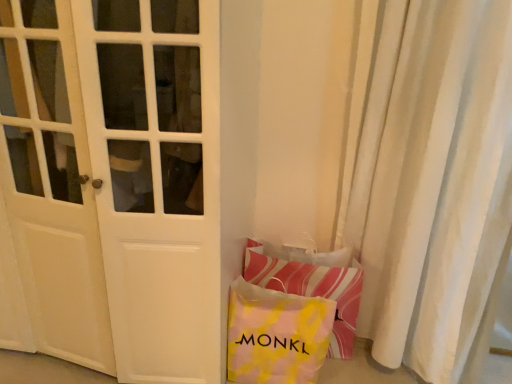
The image size is (512, 384). Describe the element at coordinates (115, 180) in the screenshot. I see `white matte door at center` at that location.

Describe the element at coordinates (276, 335) in the screenshot. I see `yellow tie-dye fabric bag at lower right` at that location.

The width and height of the screenshot is (512, 384). What do you see at coordinates (312, 290) in the screenshot?
I see `striped fabric pillow at lower right` at bounding box center [312, 290].

What are the coordinates of `white textured curtain at right` in the screenshot? It's located at (434, 185).

Can you confirm if white textured curtain at right is shorter than yellow tie-dye fabric bag at lower right?

No, white textured curtain at right is not shorter than yellow tie-dye fabric bag at lower right.

In the scene shown: Is white textured curtain at right completely or partially outside of yellow tie-dye fabric bag at lower right?

Yes, white textured curtain at right is located beyond the bounds of yellow tie-dye fabric bag at lower right.

Considering the relative positions of white textured curtain at right and yellow tie-dye fabric bag at lower right in the image provided, is white textured curtain at right in front of yellow tie-dye fabric bag at lower right?

Yes, white textured curtain at right is closer to the camera.

Relative to white matte door at center, is white textured curtain at right in front or behind?

Visually, white textured curtain at right is located behind white matte door at center.

From their relative heights in the image, would you say white textured curtain at right is taller or shorter than white matte door at center?

In the image, white textured curtain at right appears to be taller than white matte door at center.

Is white textured curtain at right aimed at white matte door at center?

No, white textured curtain at right is not oriented towards white matte door at center.

From the image's perspective, is white textured curtain at right above or below white matte door at center?

From the image's perspective, white textured curtain at right appears below white matte door at center.

From a real-world perspective, which object stands above the other?

white matte door at center.

Which is correct: white matte door at center is inside striped fabric pillow at lower right, or outside of it?

The correct answer is: outside.

Looking at this image, considering the positions of objects white matte door at center and striped fabric pillow at lower right in the image provided, who is more to the left, white matte door at center or striped fabric pillow at lower right?

From the viewer's perspective, white matte door at center appears more on the left side.

What's the angular difference between yellow tie-dye fabric bag at lower right and white matte door at center's facing directions?

1.44 degrees separate the facing orientations of yellow tie-dye fabric bag at lower right and white matte door at center.

Considering the relative sizes of yellow tie-dye fabric bag at lower right and white matte door at center in the image provided, is yellow tie-dye fabric bag at lower right smaller than white matte door at center?

Yes.

Is yellow tie-dye fabric bag at lower right behind white matte door at center?

That is True.

Is point (283, 342) closer or farther from the camera than point (134, 158)?

Point (283, 342).

Is point (383, 346) positioned after point (248, 266)?

No.

From the image's perspective, would you say white textured curtain at right is shown under striped fabric pillow at lower right?

No, from the image's perspective, white textured curtain at right is not beneath striped fabric pillow at lower right.

Is white textured curtain at right surrounding striped fabric pillow at lower right?

Yes, white textured curtain at right contains striped fabric pillow at lower right.

From a real-world perspective, which is physically below, white textured curtain at right or striped fabric pillow at lower right?

From a 3D spatial view, striped fabric pillow at lower right is below.

Based on their positions, is white matte door at center located to the left or right of yellow tie-dye fabric bag at lower right?

white matte door at center is to the left of yellow tie-dye fabric bag at lower right.

Does white matte door at center have a lesser width compared to yellow tie-dye fabric bag at lower right?

No, white matte door at center is not thinner than yellow tie-dye fabric bag at lower right.

What's the angular difference between white matte door at center and yellow tie-dye fabric bag at lower right's facing directions?

They differ by 1.44 degrees in their facing directions.

Are yellow tie-dye fabric bag at lower right and white textured curtain at right beside each other?

No, yellow tie-dye fabric bag at lower right is not with white textured curtain at right.

Can you confirm if yellow tie-dye fabric bag at lower right is positioned to the left of white textured curtain at right?

Correct, you'll find yellow tie-dye fabric bag at lower right to the left of white textured curtain at right.

Find the location of a particular element. pouch below the white textured curtain at right (from the image's perspective) is located at coordinates (276, 335).

Looking at their sizes, would you say yellow tie-dye fabric bag at lower right is wider or thinner than white textured curtain at right?

In the image, yellow tie-dye fabric bag at lower right appears to be more narrow than white textured curtain at right.

Where is `curtain above the yellow tie-dye fabric bag at lower right (from the image's perspective)`? Image resolution: width=512 pixels, height=384 pixels. curtain above the yellow tie-dye fabric bag at lower right (from the image's perspective) is located at coordinates (434, 185).

Where is `curtain behind the white matte door at center`? The height and width of the screenshot is (384, 512). curtain behind the white matte door at center is located at coordinates (434, 185).

Based on their spatial positions, is striped fabric pillow at lower right or white matte door at center further from yellow tie-dye fabric bag at lower right?

white matte door at center is positioned further to the anchor yellow tie-dye fabric bag at lower right.

Estimate the real-world distances between objects in this image. Which object is further from white matte door at center, yellow tie-dye fabric bag at lower right or white textured curtain at right?

white textured curtain at right lies further to white matte door at center than the other object.

From the picture: Estimate the real-world distances between objects in this image. Which object is closer to white textured curtain at right, yellow tie-dye fabric bag at lower right or white matte door at center?

Based on the image, yellow tie-dye fabric bag at lower right appears to be nearer to white textured curtain at right.

Considering their positions, is striped fabric pillow at lower right positioned closer to white textured curtain at right than white matte door at center?

striped fabric pillow at lower right.

Estimate the real-world distances between objects in this image. Which object is closer to white textured curtain at right, white matte door at center or striped fabric pillow at lower right?

Among the two, striped fabric pillow at lower right is located nearer to white textured curtain at right.

When comparing their distances from striped fabric pillow at lower right, does white matte door at center or yellow tie-dye fabric bag at lower right seem closer?

Among the two, yellow tie-dye fabric bag at lower right is located nearer to striped fabric pillow at lower right.

Based on their spatial positions, is white textured curtain at right or white matte door at center closer to striped fabric pillow at lower right?

white textured curtain at right is positioned closer to the anchor striped fabric pillow at lower right.

Estimate the real-world distances between objects in this image. Which object is closer to white matte door at center, striped fabric pillow at lower right or yellow tie-dye fabric bag at lower right?

yellow tie-dye fabric bag at lower right.

Locate an element on the screen. This screenshot has width=512, height=384. pouch positioned between white textured curtain at right and striped fabric pillow at lower right from near to far is located at coordinates (276, 335).

I want to click on pillow between white matte door at center and white textured curtain at right, so click(312, 290).

The image size is (512, 384). I want to click on pouch between white matte door at center and white textured curtain at right from left to right, so click(276, 335).

Locate an element on the screen. pouch between white matte door at center and striped fabric pillow at lower right is located at coordinates (276, 335).